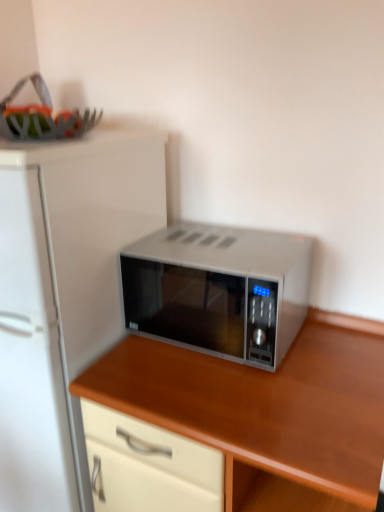
Question: Is white matte refrigerator at left inside satin silver microwave at center?

Choices:
 (A) no
 (B) yes

Answer: (A)

Question: From the image's perspective, is satin silver microwave at center on white matte refrigerator at left?

Choices:
 (A) yes
 (B) no

Answer: (B)

Question: Is satin silver microwave at center positioned far away from white matte refrigerator at left?

Choices:
 (A) no
 (B) yes

Answer: (A)

Question: Considering the relative positions of satin silver microwave at center and white matte refrigerator at left in the image provided, is satin silver microwave at center to the right of white matte refrigerator at left from the viewer's perspective?

Choices:
 (A) no
 (B) yes

Answer: (B)

Question: Is the position of satin silver microwave at center more distant than that of white matte refrigerator at left?

Choices:
 (A) yes
 (B) no

Answer: (B)

Question: Is satin silver microwave at center to the left or to the right of white matte refrigerator at left in the image?

Choices:
 (A) left
 (B) right

Answer: (B)

Question: Considering their positions, is satin silver microwave at center located in front of or behind white matte refrigerator at left?

Choices:
 (A) behind
 (B) front

Answer: (A)

Question: Does point (135, 293) appear closer or farther from the camera than point (61, 185)?

Choices:
 (A) farther
 (B) closer

Answer: (A)

Question: Looking at their shapes, would you say satin silver microwave at center is wider or thinner than white matte refrigerator at left?

Choices:
 (A) wide
 (B) thin

Answer: (B)

Question: From the image's perspective, is satin silver microwave at center positioned above or below white matte refrigerator at left?

Choices:
 (A) below
 (B) above

Answer: (A)

Question: Is satin silver microwave at center situated inside white matte refrigerator at left or outside?

Choices:
 (A) outside
 (B) inside

Answer: (A)

Question: In the image, is satin silver microwave at center on the left side or the right side of white matte refrigerator at left?

Choices:
 (A) right
 (B) left

Answer: (A)

Question: In terms of height, does satin silver microwave at center look taller or shorter compared to white matte refrigerator at left?

Choices:
 (A) tall
 (B) short

Answer: (B)

Question: From a real-world perspective, is white matte refrigerator at left above or below satin silver microwave at center?

Choices:
 (A) above
 (B) below

Answer: (B)

Question: Is white matte refrigerator at left wider or thinner than satin silver microwave at center?

Choices:
 (A) wide
 (B) thin

Answer: (A)